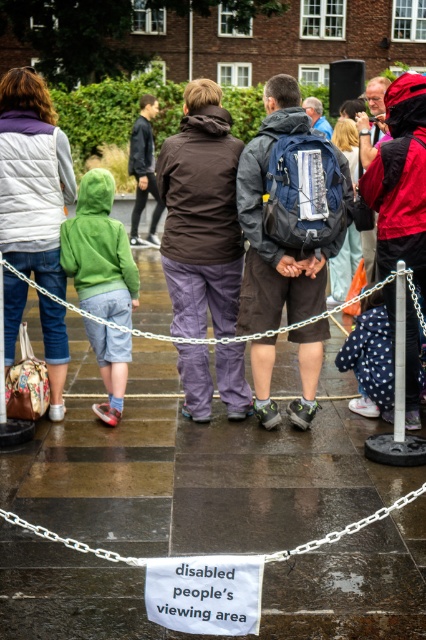
Question: Is matte black backpack at center wider than white paper sign at lower center?

Choices:
 (A) yes
 (B) no

Answer: (A)

Question: Does silver chain at center have a lesser width compared to white paper sign at lower center?

Choices:
 (A) yes
 (B) no

Answer: (B)

Question: Estimate the real-world distances between objects in this image. Which object is farther from the matte black backpack at center?

Choices:
 (A) silver chain at center
 (B) white paper sign at lower center

Answer: (B)

Question: Is matte black backpack at center above white paper sign at lower center?

Choices:
 (A) yes
 (B) no

Answer: (A)

Question: Which is nearer to the silver chain at center?

Choices:
 (A) brown fabric jacket at center
 (B) green fleece jacket at left
 (C) white paper sign at lower center

Answer: (B)

Question: Among these points, which one is nearest to the camera?

Choices:
 (A) (172, 214)
 (B) (184, 374)
 (C) (311, 317)
 (D) (307, 541)

Answer: (D)